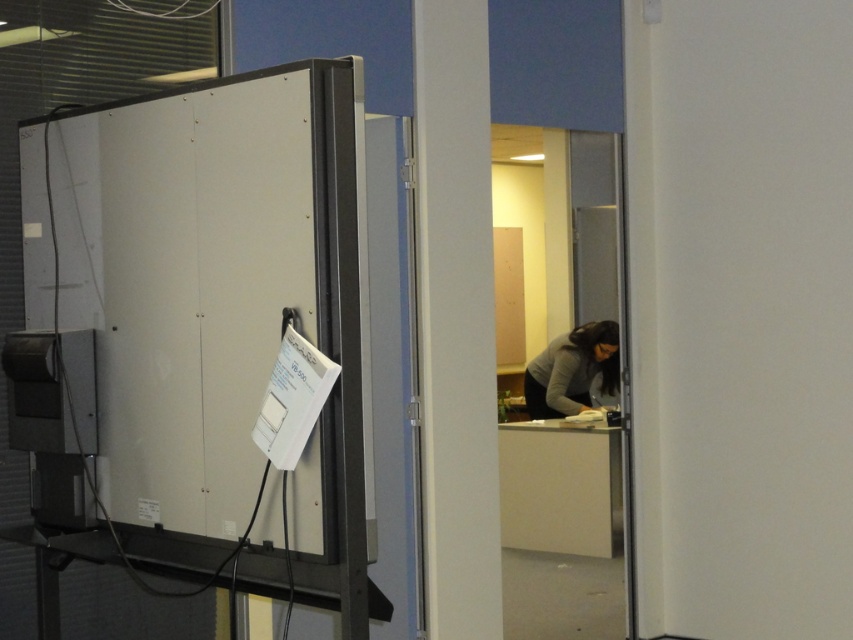
Question: Among these objects, which one is nearest to the camera?

Choices:
 (A) white smooth pillar at center
 (B) dark gray sweater at lower center

Answer: (A)

Question: From the image, what is the correct spatial relationship of white smooth pillar at center in relation to dark gray sweater at lower center?

Choices:
 (A) right
 (B) left

Answer: (B)

Question: Which point is farther to the camera?

Choices:
 (A) white smooth pillar at center
 (B) dark gray sweater at lower center

Answer: (B)

Question: Which object appears closest to the camera in this image?

Choices:
 (A) dark gray sweater at lower center
 (B) white smooth pillar at center

Answer: (B)

Question: Is white smooth pillar at center further to the viewer compared to dark gray sweater at lower center?

Choices:
 (A) no
 (B) yes

Answer: (A)

Question: Is white smooth pillar at center closer to the viewer compared to dark gray sweater at lower center?

Choices:
 (A) no
 (B) yes

Answer: (B)